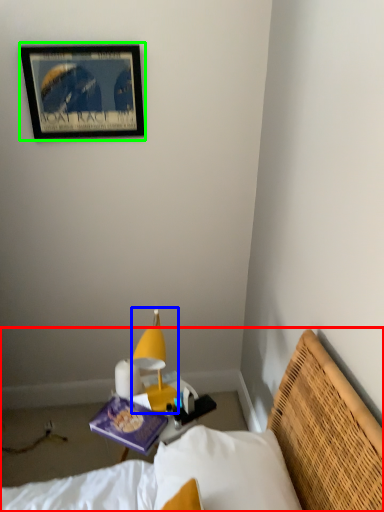
Question: Based on their relative distances, which object is nearer to bed (highlighted by a red box)? Choose from lamp (highlighted by a blue box) and picture frame (highlighted by a green box).

Choices:
 (A) lamp
 (B) picture frame

Answer: (A)